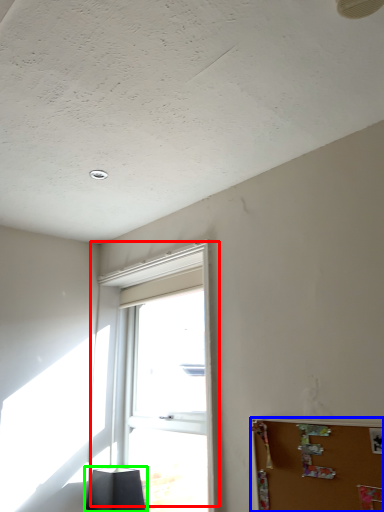
Question: Considering the real-world distances, which object is farthest from window (highlighted by a red box)? bulletin board (highlighted by a blue box) or lamp (highlighted by a green box)?

Choices:
 (A) bulletin board
 (B) lamp

Answer: (A)